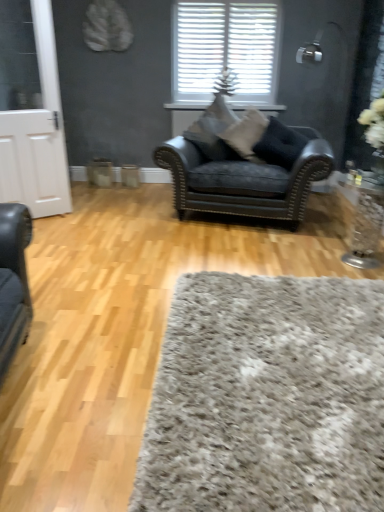
Identify the location of blank space situated above shaggy gray rug at lower center (from a real-world perspective). This screenshot has width=384, height=512. (288, 339).